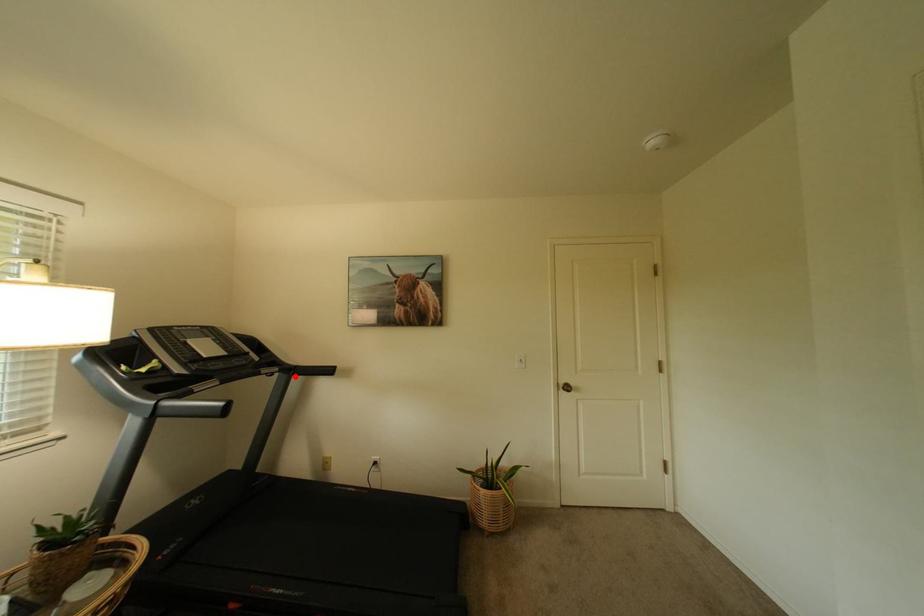
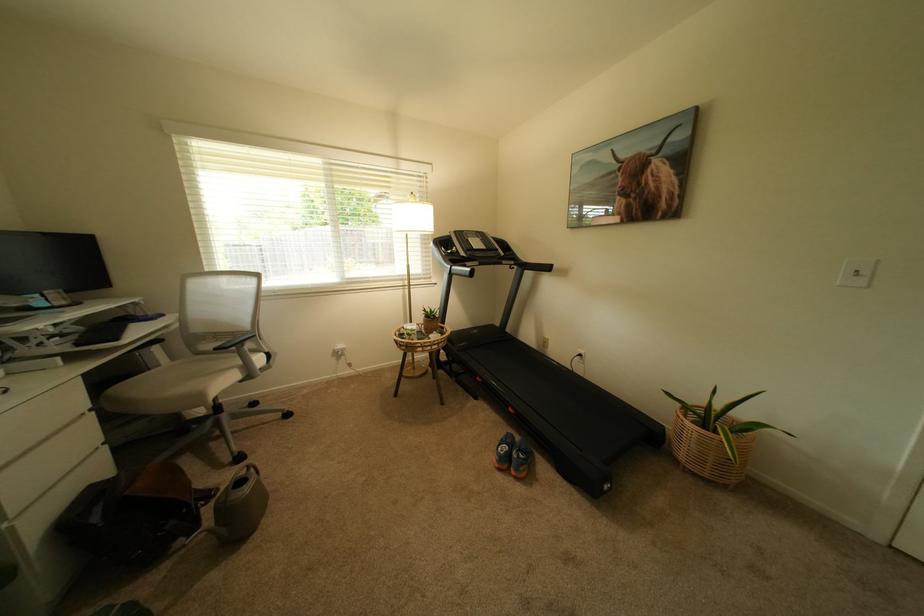
The point at the highlighted location is marked in the first image. Where is the corresponding point in the second image?

(529, 270)